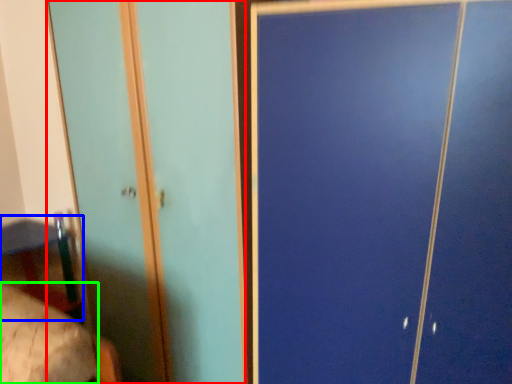
Question: Which object is positioned farthest from screen door (highlighted by a red box)? Select from table (highlighted by a blue box) and mattress (highlighted by a green box).

Choices:
 (A) table
 (B) mattress

Answer: (B)